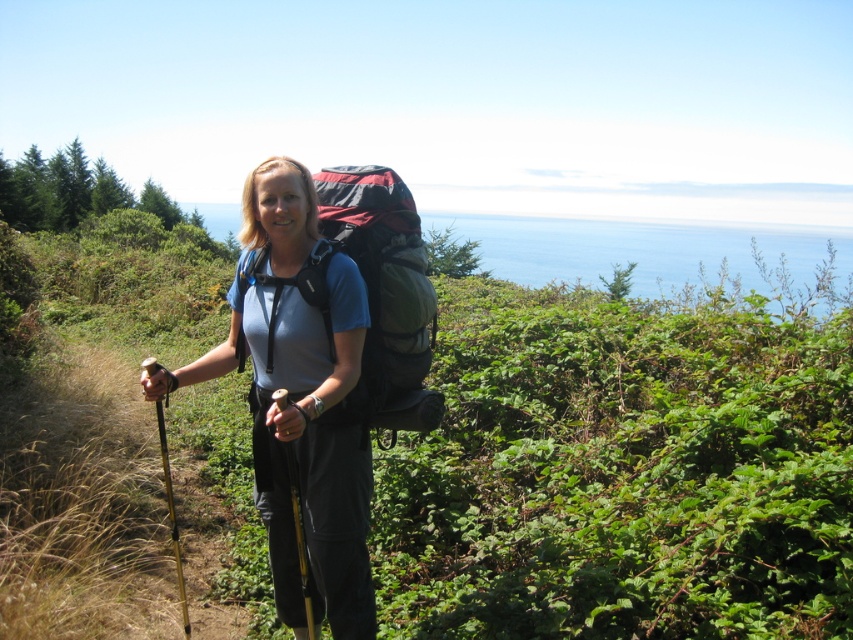
Question: Which object is closer to the camera taking this photo?

Choices:
 (A) matte black backpack at center
 (B) matte gray backpack at center

Answer: (B)

Question: Does matte gray backpack at center have a smaller size compared to matte black backpack at center?

Choices:
 (A) yes
 (B) no

Answer: (B)

Question: Which object is farther from the camera taking this photo?

Choices:
 (A) matte gray backpack at center
 (B) matte black backpack at center

Answer: (B)

Question: Which point is closer to the camera?

Choices:
 (A) matte gray backpack at center
 (B) matte black backpack at center

Answer: (A)

Question: Considering the relative positions of matte gray backpack at center and matte black backpack at center in the image provided, where is matte gray backpack at center located with respect to matte black backpack at center?

Choices:
 (A) above
 (B) below

Answer: (B)

Question: Can you confirm if matte gray backpack at center is thinner than matte black backpack at center?

Choices:
 (A) no
 (B) yes

Answer: (B)